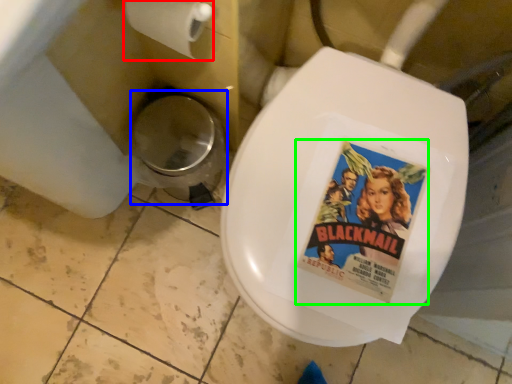
Question: Based on their relative distances, which object is nearer to toilet paper (highlighted by a red box)? Choose from potty (highlighted by a blue box) and movie poster (highlighted by a green box).

Choices:
 (A) potty
 (B) movie poster

Answer: (A)